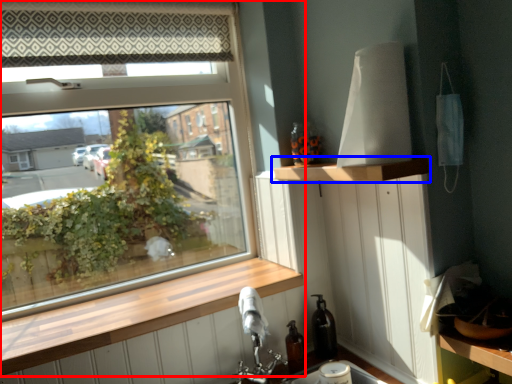
Question: Which object appears farthest to the camera in this image, window (highlighted by a red box) or shelf (highlighted by a blue box)?

Choices:
 (A) window
 (B) shelf

Answer: (A)